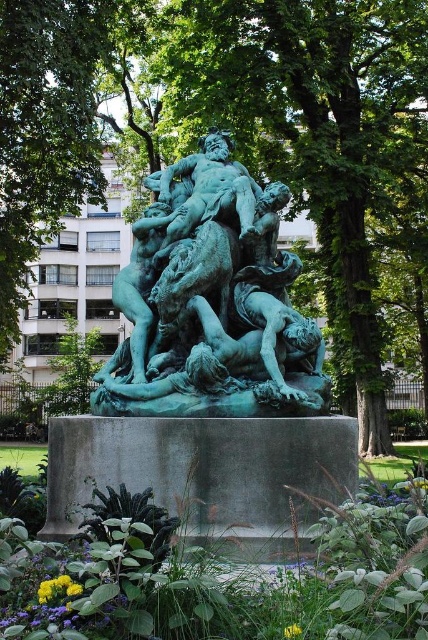
Is green patina statue at center thinner than green stone statue at center?

Correct, green patina statue at center's width is less than green stone statue at center's.

Is green patina statue at center to the left of green stone statue at center from the viewer's perspective?

Indeed, green patina statue at center is positioned on the left side of green stone statue at center.

Locate an element on the screen. This screenshot has width=428, height=640. green patina statue at center is located at coordinates (211, 301).

Locate an element on the screen. green patina statue at center is located at coordinates (211, 301).